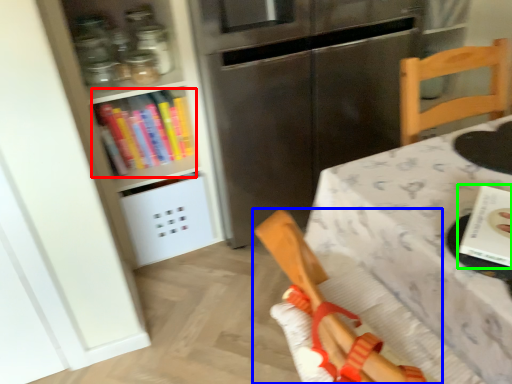
Question: Which object is the closest to the book (highlighted by a red box)? Choose among these: chair (highlighted by a blue box) or book (highlighted by a green box).

Choices:
 (A) chair
 (B) book

Answer: (A)